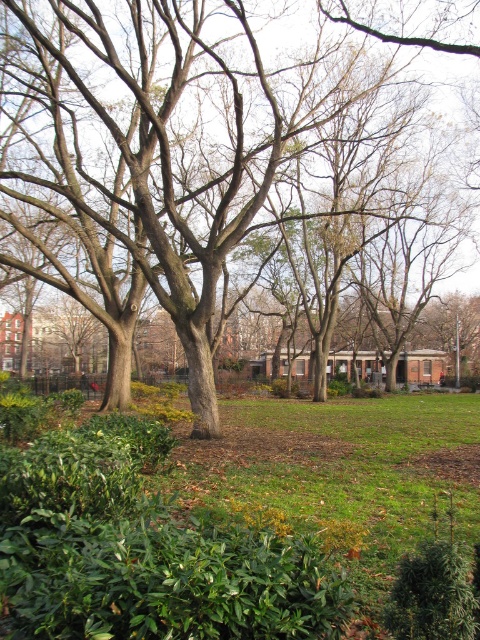
Who is positioned more to the right, green leafy shrubs at lower left or brown rough tree at center?

green leafy shrubs at lower left is more to the right.

Is green leafy shrubs at lower left smaller than brown rough tree at center?

Yes.

This screenshot has height=640, width=480. Identify the location of green leafy shrubs at lower left. (207, 529).

The image size is (480, 640). In order to click on green leafy shrubs at lower left in this screenshot , I will do `click(207, 529)`.